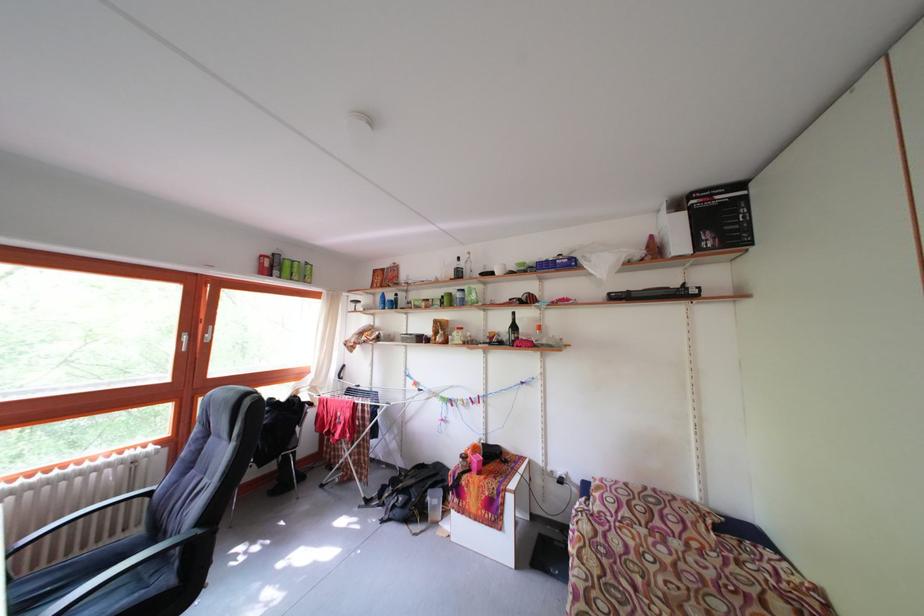
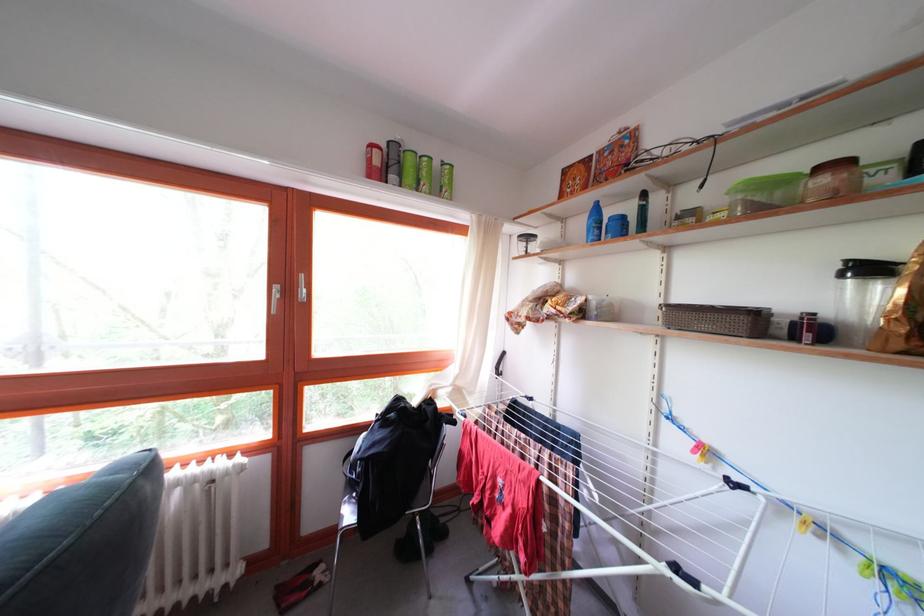
The point at (300,280) is marked in the first image. Where is the corresponding point in the second image?

(428, 187)